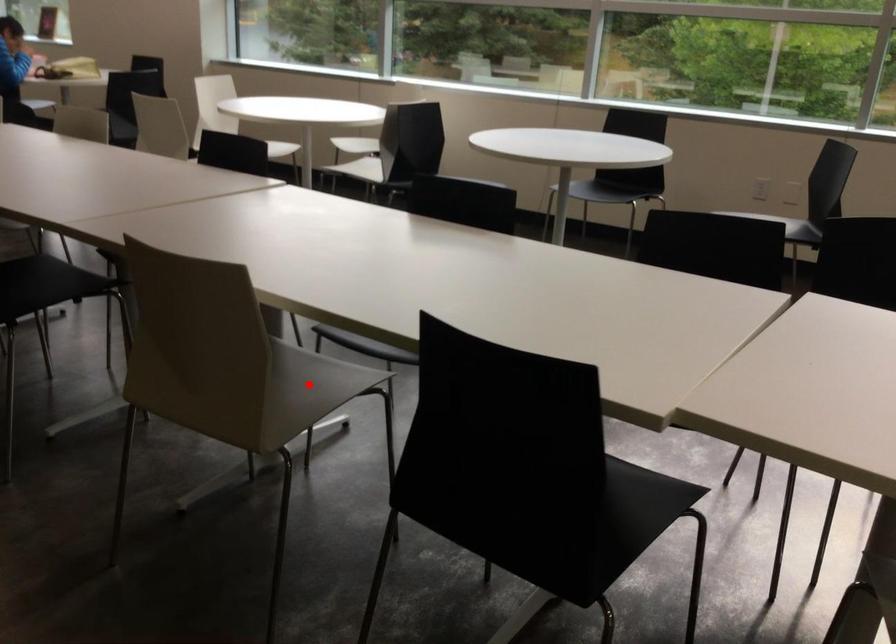
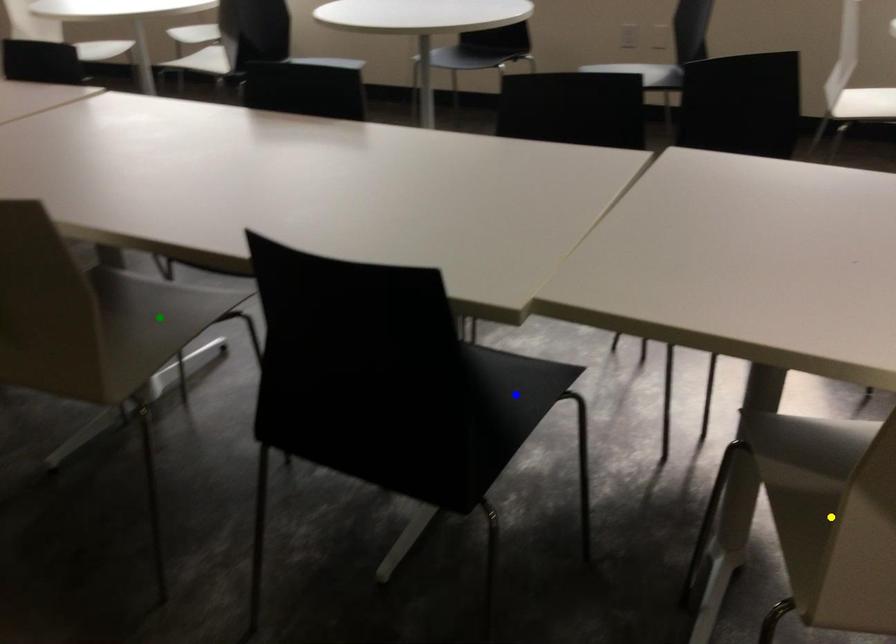
Question: I am providing you with two images of the same scene from different viewpoints. A red point is marked on the first image. You are given multiple points on the second image. Which mark in image 2 goes with the point in image 1?

Choices:
 (A) blue point
 (B) yellow point
 (C) green point

Answer: (C)